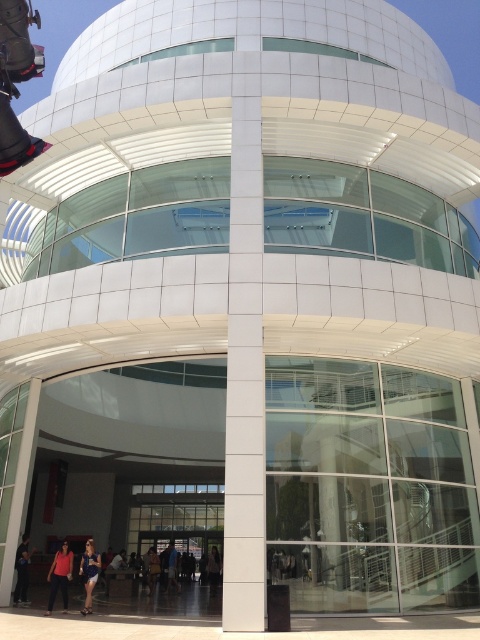
Question: Among these objects, which one is farthest from the camera?

Choices:
 (A) dark blue jeans at lower left
 (B) blue denim shorts at lower left
 (C) matte red shirt at lower left
 (D) dark brown leather jacket at center

Answer: (D)

Question: Which of the following is the closest to the observer?

Choices:
 (A) (90, 552)
 (B) (217, 564)
 (C) (52, 564)

Answer: (C)

Question: Is matte red shirt at lower left smaller than blue denim shorts at lower left?

Choices:
 (A) no
 (B) yes

Answer: (A)

Question: Is blue denim shorts at lower left below dark blue jeans at lower left?

Choices:
 (A) yes
 (B) no

Answer: (A)

Question: Is blue denim shorts at lower left smaller than dark brown leather jacket at center?

Choices:
 (A) yes
 (B) no

Answer: (B)

Question: Which point appears closest to the camera in this image?

Choices:
 (A) (216, 554)
 (B) (69, 564)
 (C) (17, 554)

Answer: (B)